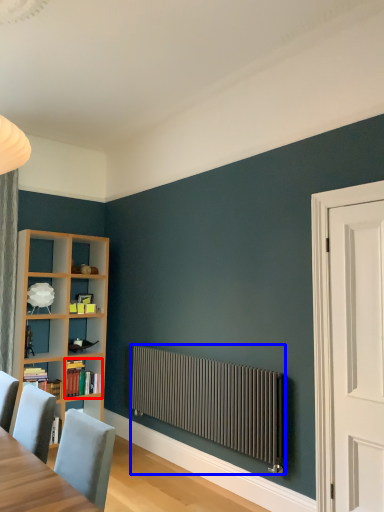
Question: Which object appears farthest to the camera in this image, book (highlighted by a red box) or radiator (highlighted by a blue box)?

Choices:
 (A) book
 (B) radiator

Answer: (A)